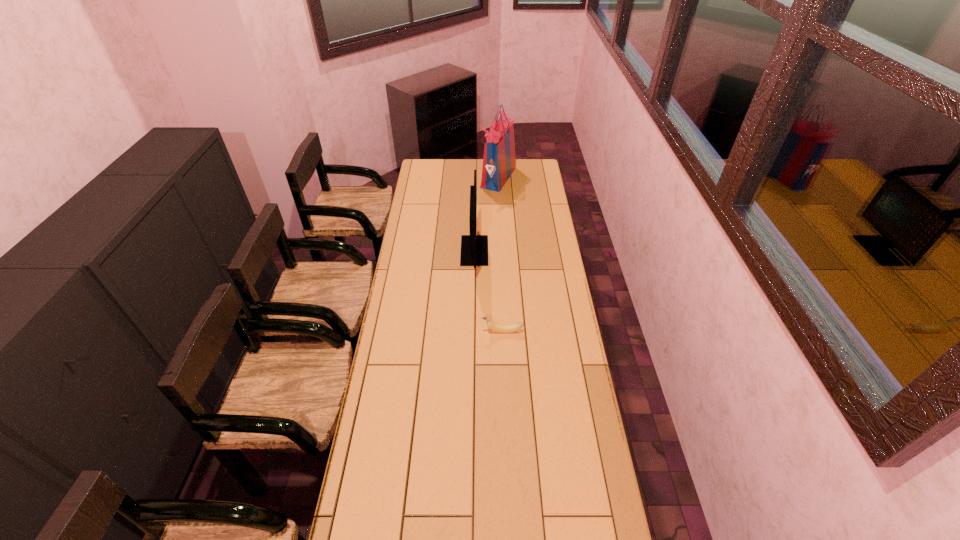
This screenshot has height=540, width=960. I want to click on free space that is in between the banana and the farthest object, so click(500, 254).

Locate an element on the screen. free space between the shortest object and the second nearest object is located at coordinates (489, 291).

Locate an element on the screen. The height and width of the screenshot is (540, 960). object identified as the second closest to the grocery bag is located at coordinates (491, 325).

Select which object appears as the second closest to the tallest object. Please provide its 2D coordinates. Your answer should be formatted as a tuple, i.e. [(x, y)], where the tuple contains the x and y coordinates of a point satisfying the conditions above.

[(491, 325)]